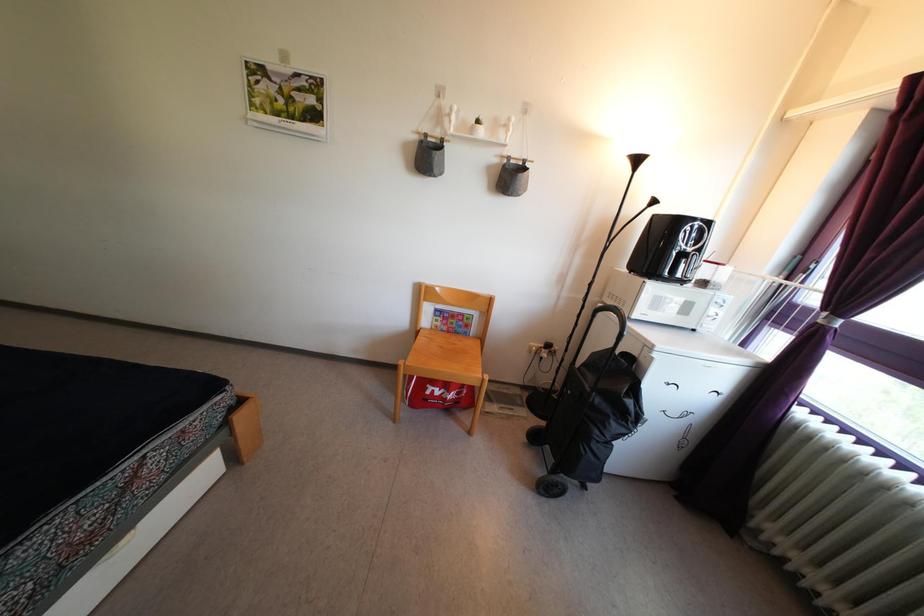
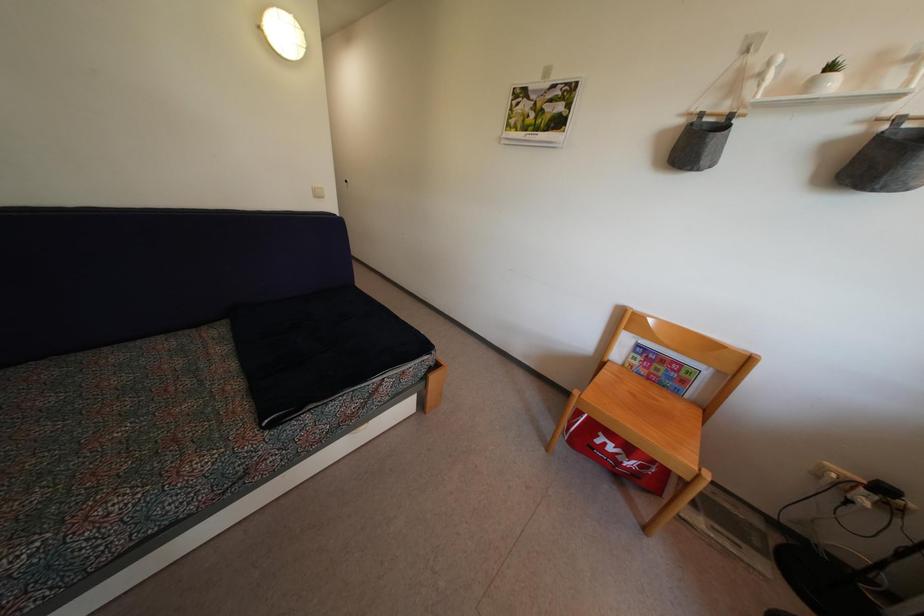
Where in the second image is the point corresponding to the point at 419,146 from the first image?

(685, 129)